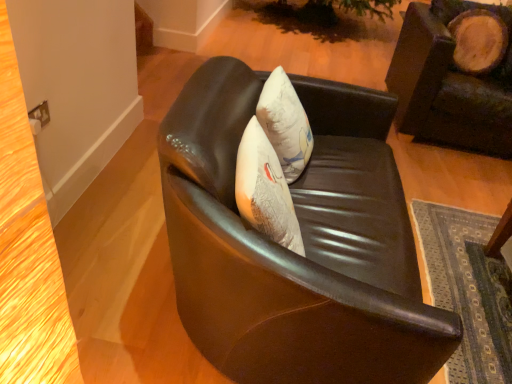
Where is `vacant space in front of leather cushion at upper right, which is the first chair in right-to-left order`? This screenshot has height=384, width=512. vacant space in front of leather cushion at upper right, which is the first chair in right-to-left order is located at coordinates (455, 190).